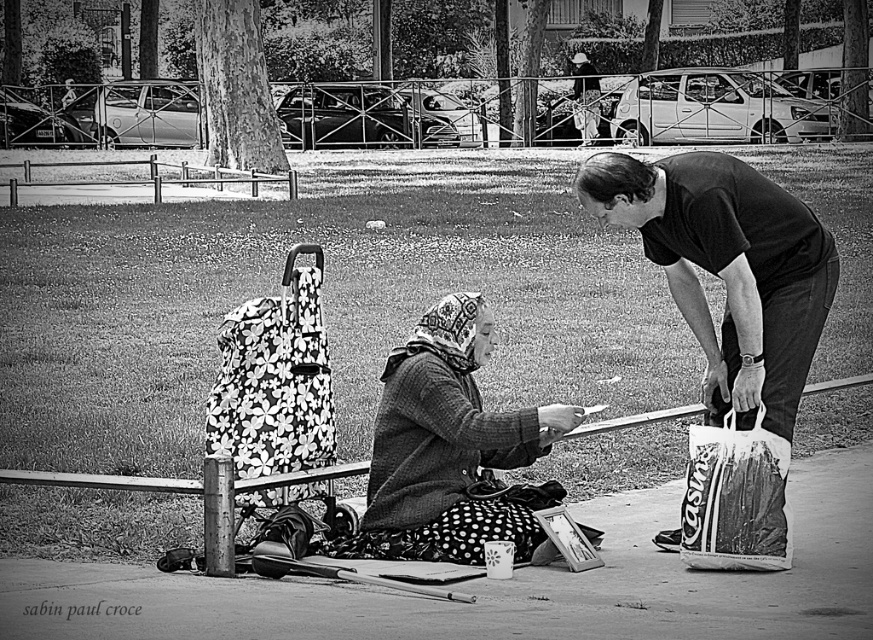
Between knitted woolen scarf at center and floral fabric baby carriage at left, which one has less height?

Standing shorter between the two is floral fabric baby carriage at left.

Is knitted woolen scarf at center to the left of floral fabric baby carriage at left from the viewer's perspective?

Incorrect, knitted woolen scarf at center is not on the left side of floral fabric baby carriage at left.

This screenshot has width=873, height=640. In order to click on knitted woolen scarf at center in this screenshot , I will do pyautogui.click(x=450, y=445).

Which is behind, point (785, 237) or point (253, 433)?

Positioned behind is point (253, 433).

Between point (771, 339) and point (246, 493), which one is positioned in front?

Point (771, 339) is more forward.

Locate an element on the screen. The width and height of the screenshot is (873, 640). dark gray t-shirt at center right is located at coordinates (727, 269).

Does point (413, 480) lie behind point (775, 454)?

Yes, point (413, 480) is farther from viewer.

Between point (373, 524) and point (743, 486), which one is positioned behind?

Point (373, 524)

Where is `knitted woolen scarf at center`? knitted woolen scarf at center is located at coordinates (450, 445).